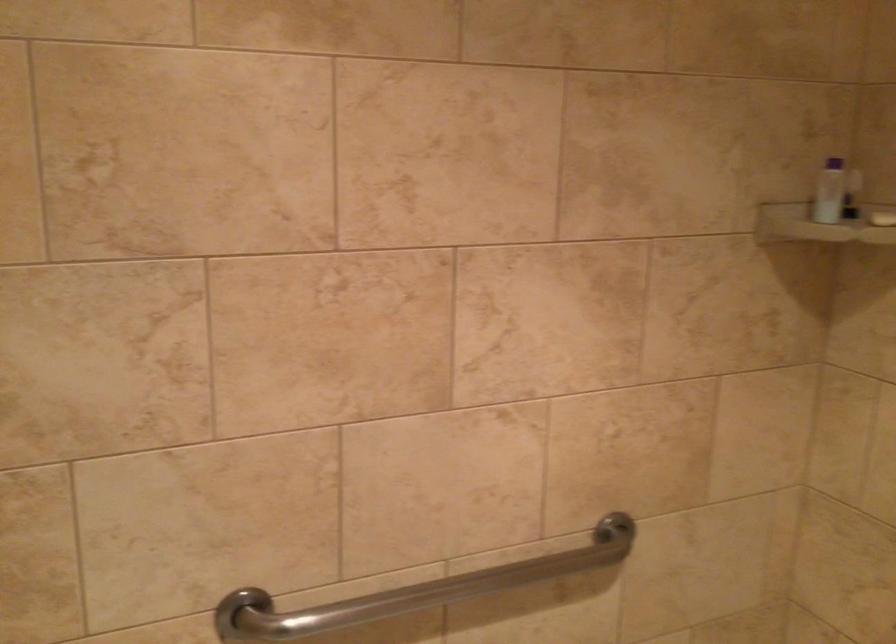
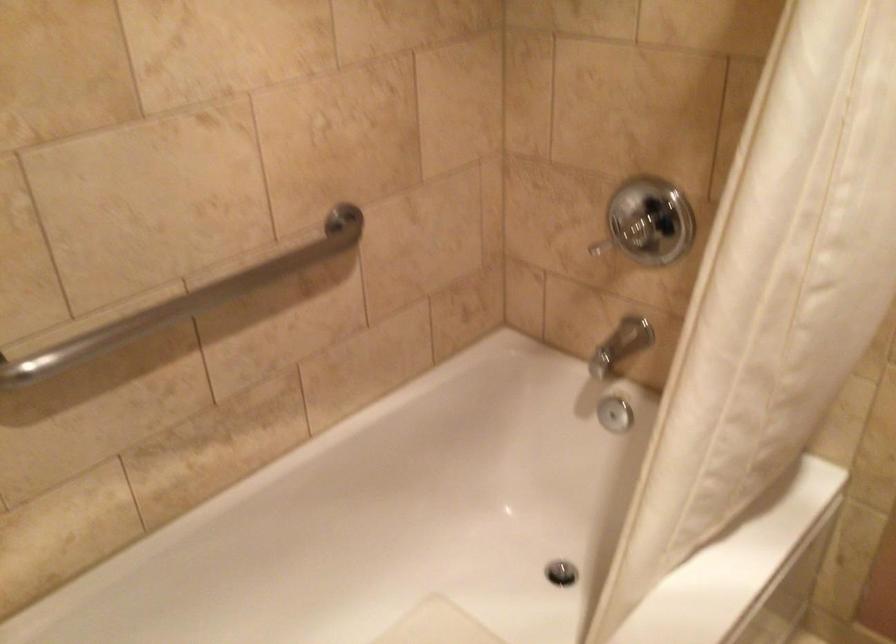
Question: In a continuous first-person perspective shot, in which direction is the camera moving?

Choices:
 (A) Left
 (B) Right
 (C) Forward
 (D) Backward

Answer: (A)